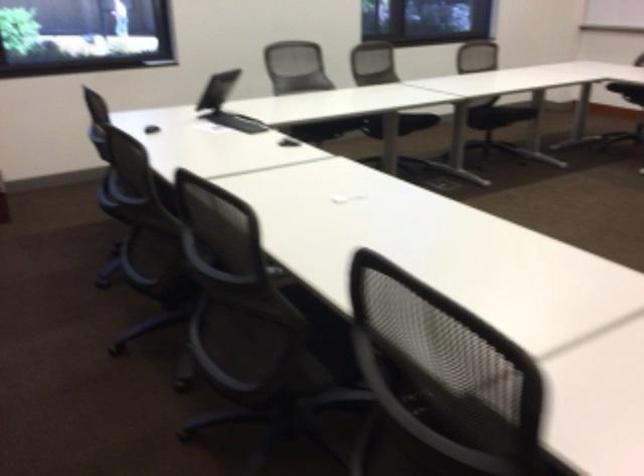
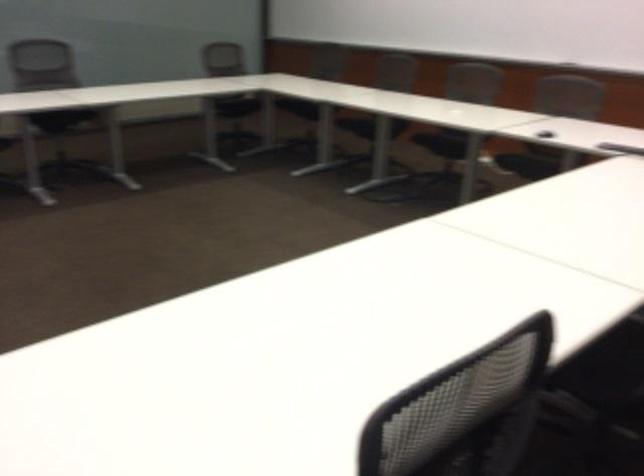
Question: Which direction would the cameraman need to move to produce the second image? Reply with the corresponding letter.

Choices:
 (A) Left
 (B) Right
 (C) Forward
 (D) Backward

Answer: (D)